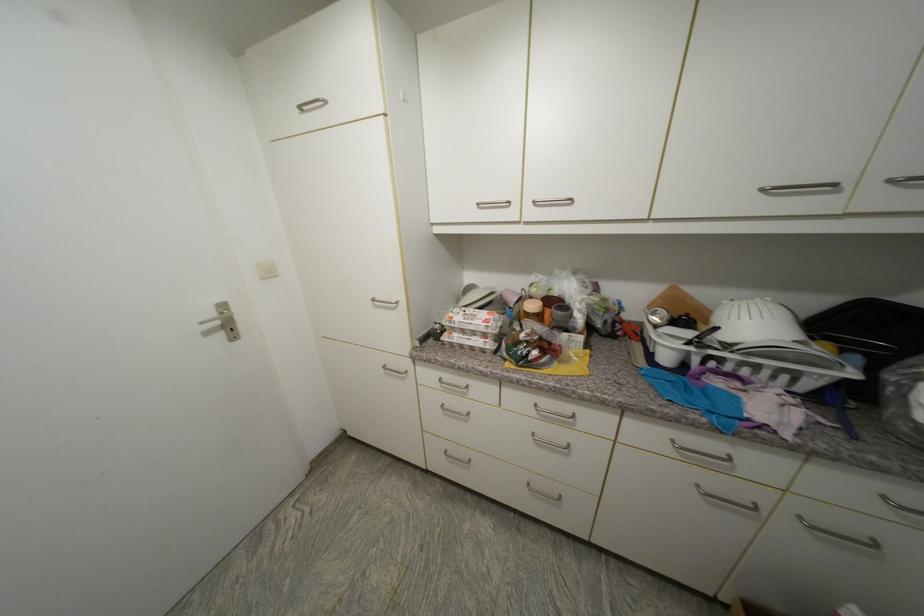
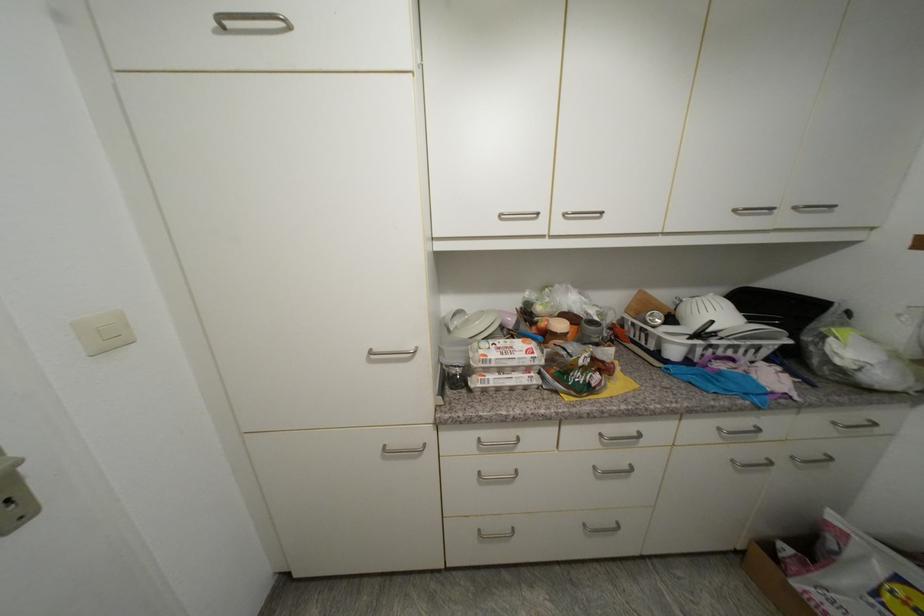
Locate, in the second image, the point that corresponds to [703,488] in the first image.

(738, 463)